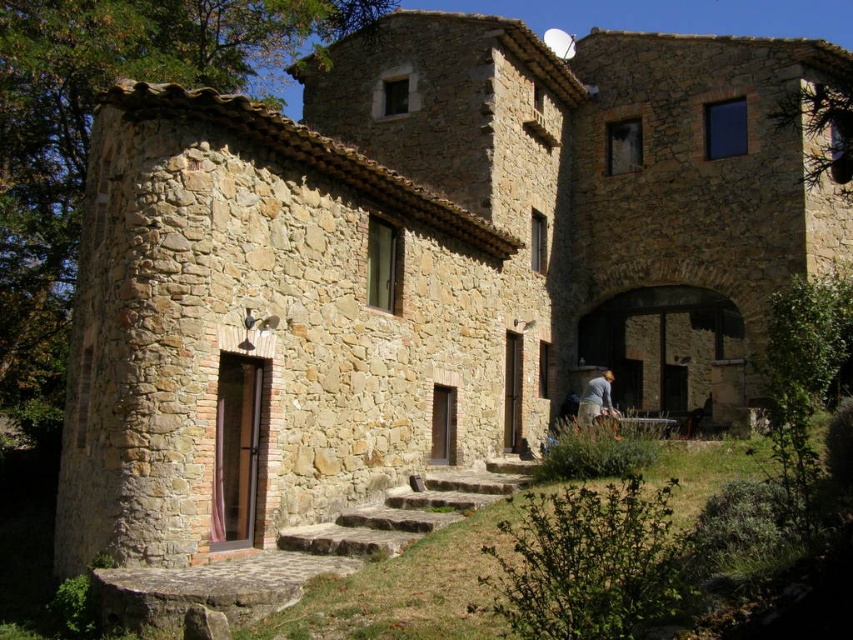
Can you confirm if natural stone stairs at lower center is bigger than natural stone stairs at center?

Correct, natural stone stairs at lower center is larger in size than natural stone stairs at center.

Identify the location of natural stone stairs at lower center. (300, 554).

Can you confirm if natural stone stairs at center is positioned to the right of gray fabric shirt at lower right?

In fact, natural stone stairs at center is to the left of gray fabric shirt at lower right.

Is natural stone stairs at center below gray fabric shirt at lower right?

Correct, natural stone stairs at center is located below gray fabric shirt at lower right.

Between point (514, 486) and point (593, 400), which one is positioned in front?

Point (514, 486)

Where is `natural stone stairs at center`? The height and width of the screenshot is (640, 853). natural stone stairs at center is located at coordinates (409, 513).

Who is positioned more to the left, natural stone stairs at lower center or gray fabric shirt at lower right?

Positioned to the left is natural stone stairs at lower center.

Which is behind, point (219, 586) or point (604, 396)?

The point (604, 396) is behind.

Find the location of a particular element. natural stone stairs at lower center is located at coordinates 300,554.